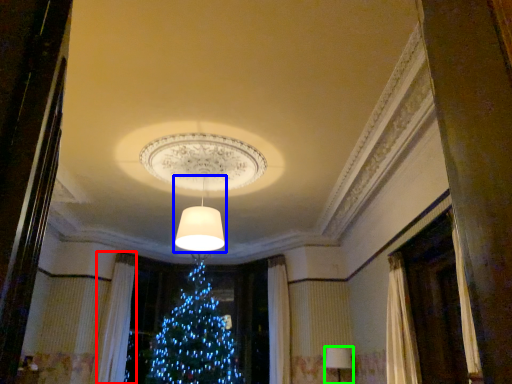
Question: Which is nearer to the curtain (highlighted by a red box)? lamp (highlighted by a blue box) or lamp (highlighted by a green box).

Choices:
 (A) lamp
 (B) lamp

Answer: (A)